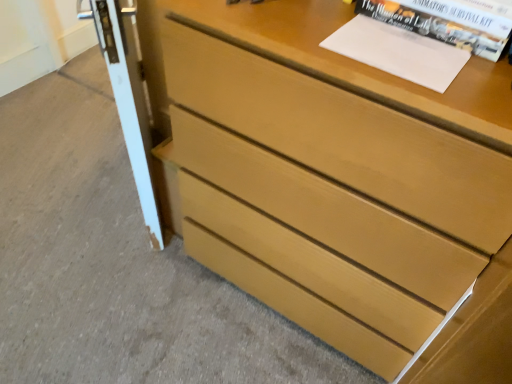
Find the location of a particular element. This screenshot has width=512, height=384. vacant space situated on the left part of white paper at upper right is located at coordinates (298, 31).